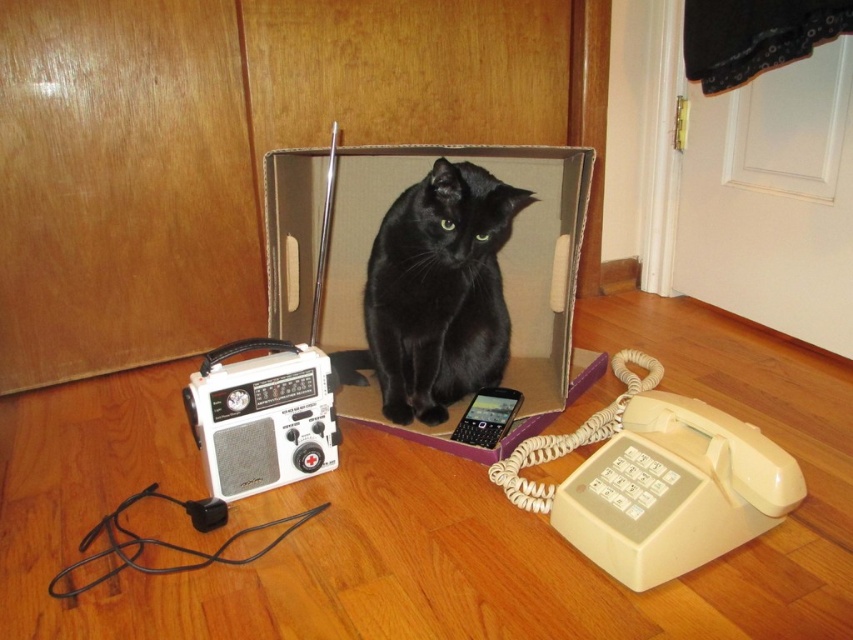
Question: Considering the real-world distances, which object is farthest from the white plastic radio at lower left?

Choices:
 (A) cardboard box at center
 (B) black plastic phone at center
 (C) black glossy cat at center

Answer: (B)

Question: Is cardboard box at center thinner than black plastic phone at center?

Choices:
 (A) yes
 (B) no

Answer: (B)

Question: Considering the real-world distances, which object is closest to the white plastic radio at lower left?

Choices:
 (A) cardboard box at center
 (B) black plastic phone at center

Answer: (A)

Question: Which of the following is the farthest from the observer?

Choices:
 (A) (252, 340)
 (B) (529, 280)
 (C) (502, 388)
 (D) (438, 333)

Answer: (B)

Question: From the image, what is the correct spatial relationship of cardboard box at center in relation to black plastic phone at center?

Choices:
 (A) above
 (B) below

Answer: (A)

Question: Where is black glossy cat at center located in relation to black plastic phone at center in the image?

Choices:
 (A) above
 (B) below

Answer: (A)